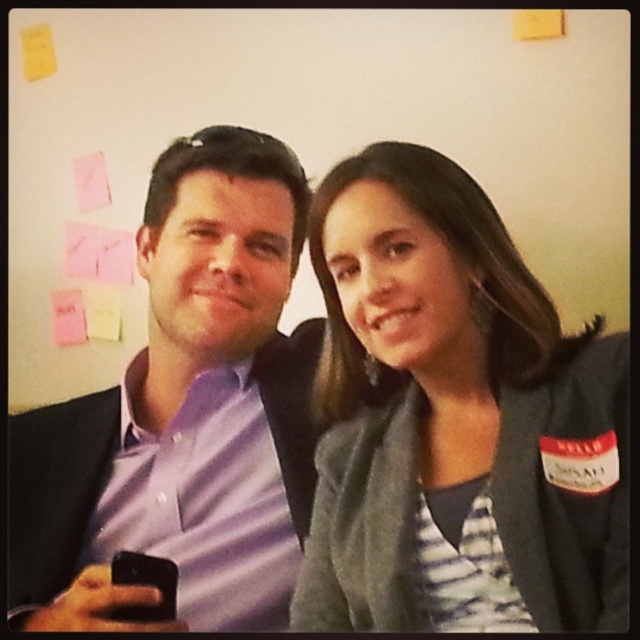
Question: Is gray fabric jacket at upper right positioned before purple shirt at center?

Choices:
 (A) yes
 (B) no

Answer: (A)

Question: Which point is closer to the camera?

Choices:
 (A) (76, 595)
 (B) (337, 333)

Answer: (A)

Question: Is gray fabric jacket at upper right behind purple shirt at center?

Choices:
 (A) no
 (B) yes

Answer: (A)

Question: Does gray fabric jacket at upper right come in front of purple shirt at center?

Choices:
 (A) no
 (B) yes

Answer: (B)